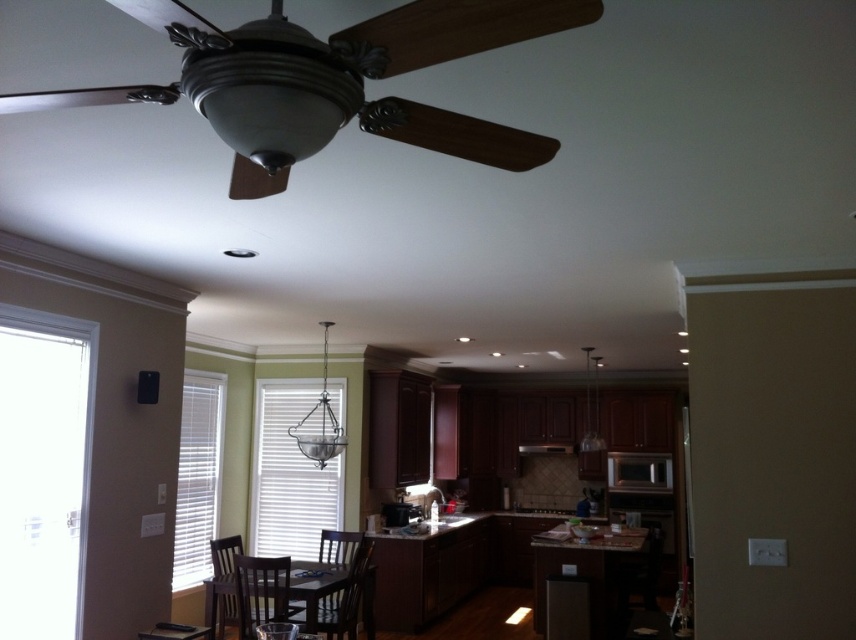
Question: Can you confirm if metallic brown ceiling fan at upper center is thinner than dark brown wooden chair at center?

Choices:
 (A) no
 (B) yes

Answer: (A)

Question: Can you confirm if metallic brown ceiling fan at upper center is positioned to the right of dark brown wooden chair at center?

Choices:
 (A) yes
 (B) no

Answer: (A)

Question: Which point is closer to the camera?

Choices:
 (A) satin nickel exhaust hood at center
 (B) dark brown wooden chair at lower left
 (C) brown wooden chair at center
 (D) metallic brown ceiling fan at upper center

Answer: (D)

Question: From the image, what is the correct spatial relationship of dark brown wooden chair at lower left in relation to black glossy microwave at center?

Choices:
 (A) below
 (B) above

Answer: (A)

Question: Which point is farther to the camera?

Choices:
 (A) (369, 552)
 (B) (241, 600)
 (C) (217, 566)
 (D) (541, 445)

Answer: (D)

Question: Among these points, which one is nearest to the camera?

Choices:
 (A) (220, 616)
 (B) (331, 45)
 (C) (302, 621)

Answer: (B)